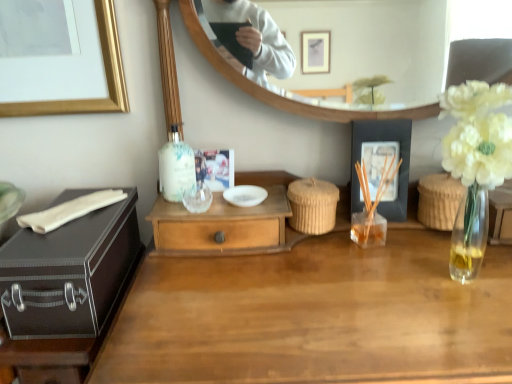
Question: Considering their positions, is black matte picture frame at right located in front of or behind wooden desk at center?

Choices:
 (A) front
 (B) behind

Answer: (B)

Question: Is black matte picture frame at right to the left or to the right of wooden desk at center in the image?

Choices:
 (A) right
 (B) left

Answer: (A)

Question: Estimate the real-world distances between objects in this image. Which object is farther from the wooden desk at center?

Choices:
 (A) wooden drawer at center
 (B) matte black suitcase at left
 (C) clear glass vase at right, the 2th picnic basket in the left-to-right sequence
 (D) translucent glass bottle at upper center
 (E) black matte picture frame at right

Answer: (D)

Question: Estimate the real-world distances between objects in this image. Which object is closer to the white glossy bowl at center?

Choices:
 (A) wooden desk at center
 (B) translucent glass bottle at upper center
 (C) black matte picture frame at right
 (D) transparent glass wine glass at center
 (E) woven straw picnic basket at center, which is the 1th picnic basket in left-to-right order

Answer: (D)